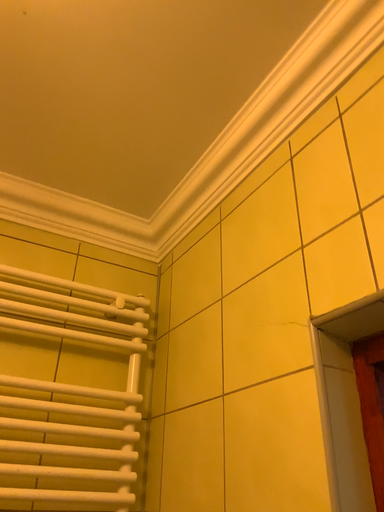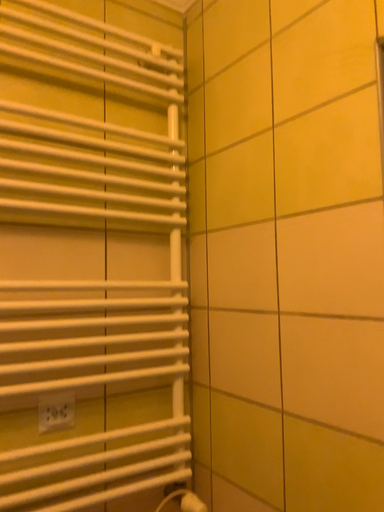
Question: How did the camera likely rotate when shooting the video?

Choices:
 (A) rotated upward
 (B) rotated downward

Answer: (B)